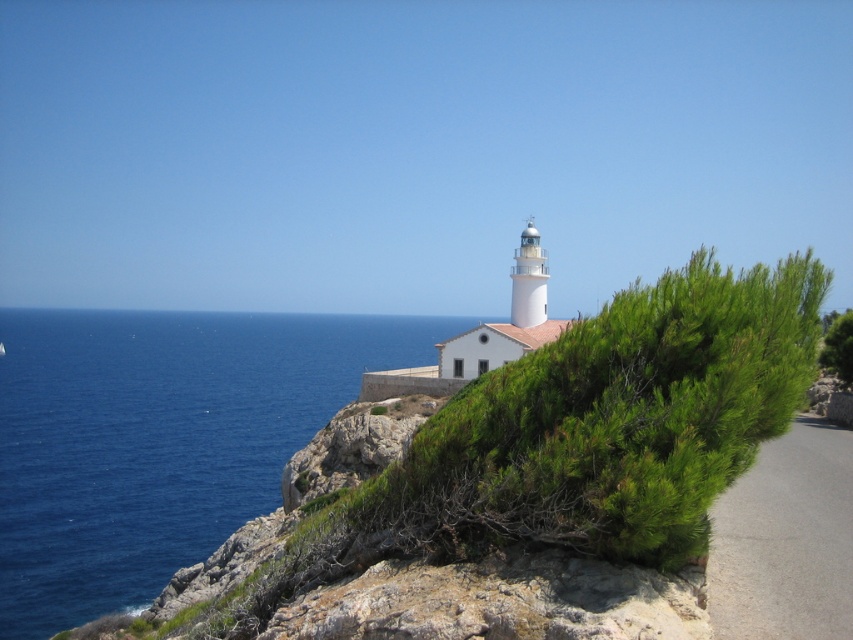
Looking at this image, does blue liquid water at left have a lesser height compared to green leafy shrub at upper right?

Incorrect, blue liquid water at left's height does not fall short of green leafy shrub at upper right's.

Is point (183, 480) positioned behind point (836, 323)?

Yes, point (183, 480) is behind point (836, 323).

I want to click on blue liquid water at left, so click(x=160, y=440).

Locate an element on the screen. blue liquid water at left is located at coordinates (160, 440).